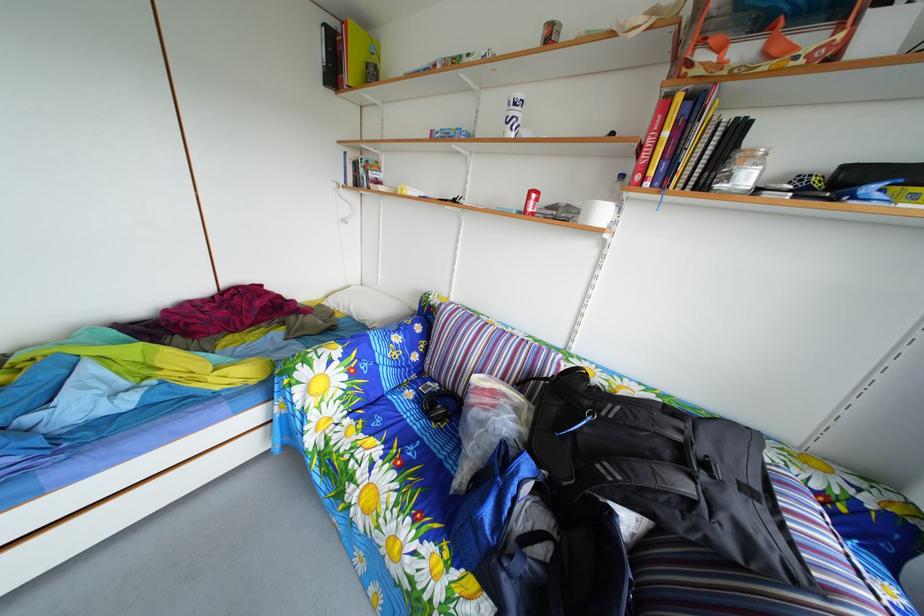
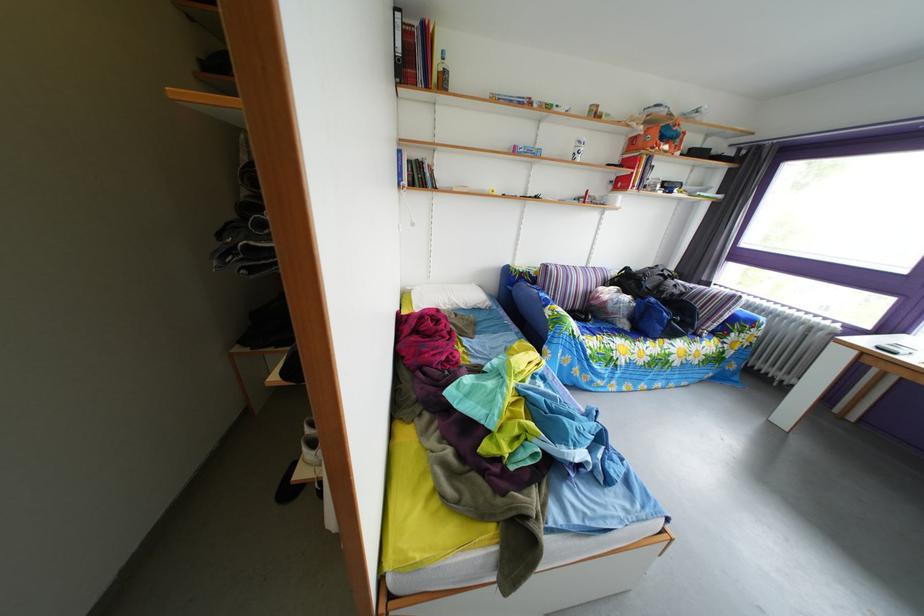
Find the pixel in the second image that matches pixel 581 347 in the first image.

(599, 270)